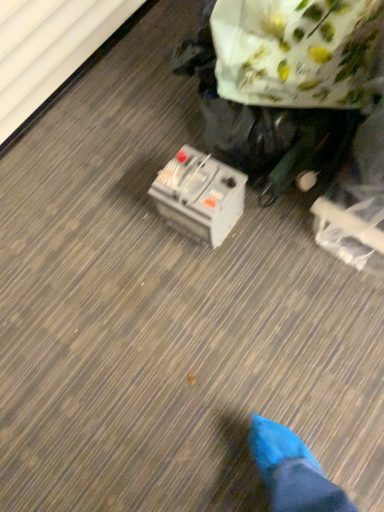
Find the location of a particular element. unoccupied area behind gray plastic battery at center is located at coordinates (156, 155).